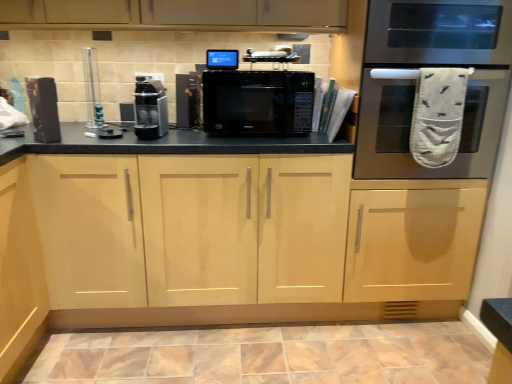
Question: From a real-world perspective, does matte black speaker at left, arranged as the 1th appliance when viewed from the left, sit lower than satin black coffee machine at center, the third appliance from the right?

Choices:
 (A) no
 (B) yes

Answer: (A)

Question: Is matte black speaker at left, arranged as the 1th appliance when viewed from the left, in front of satin black coffee machine at center, the third appliance from the right?

Choices:
 (A) yes
 (B) no

Answer: (A)

Question: From the image's perspective, would you say matte black speaker at left, the fifth appliance when ordered from right to left, is shown under satin black coffee machine at center, which appears as the third appliance when viewed from the left?

Choices:
 (A) yes
 (B) no

Answer: (A)

Question: Is satin black coffee machine at center, which appears as the third appliance when viewed from the left, a part of matte black speaker at left, the fifth appliance when ordered from right to left?

Choices:
 (A) yes
 (B) no

Answer: (B)

Question: Is matte black speaker at left, the fifth appliance when ordered from right to left, positioned with its back to satin black coffee machine at center, which appears as the third appliance when viewed from the left?

Choices:
 (A) yes
 (B) no

Answer: (B)

Question: Is marble-like ceramic tile at lower center taller or shorter than black matte microwave at center, the second appliance in the right-to-left sequence?

Choices:
 (A) tall
 (B) short

Answer: (B)

Question: Relative to black matte microwave at center, the second appliance in the right-to-left sequence, is marble-like ceramic tile at lower center in front or behind?

Choices:
 (A) front
 (B) behind

Answer: (A)

Question: From a real-world perspective, is marble-like ceramic tile at lower center positioned above or below black matte microwave at center, the second appliance in the right-to-left sequence?

Choices:
 (A) above
 (B) below

Answer: (B)

Question: Is marble-like ceramic tile at lower center spatially inside black matte microwave at center, the second appliance in the right-to-left sequence, or outside of it?

Choices:
 (A) inside
 (B) outside

Answer: (B)

Question: In the image, is black matte microwave at center positioned in front of or behind marble-like ceramic tile at lower center?

Choices:
 (A) behind
 (B) front

Answer: (A)

Question: From a real-world perspective, is black matte microwave at center physically located above or below marble-like ceramic tile at lower center?

Choices:
 (A) below
 (B) above

Answer: (B)

Question: Visually, is black matte microwave at center positioned to the left or to the right of marble-like ceramic tile at lower center?

Choices:
 (A) right
 (B) left

Answer: (B)

Question: From the image's perspective, is black matte microwave at center located above or below marble-like ceramic tile at lower center?

Choices:
 (A) above
 (B) below

Answer: (A)

Question: Considering the positions of marble-like ceramic tile at lower center and black matte microwave at center in the image, is marble-like ceramic tile at lower center wider or thinner than black matte microwave at center?

Choices:
 (A) wide
 (B) thin

Answer: (A)

Question: Is marble-like ceramic tile at lower center bigger or smaller than black matte microwave at center?

Choices:
 (A) small
 (B) big

Answer: (A)